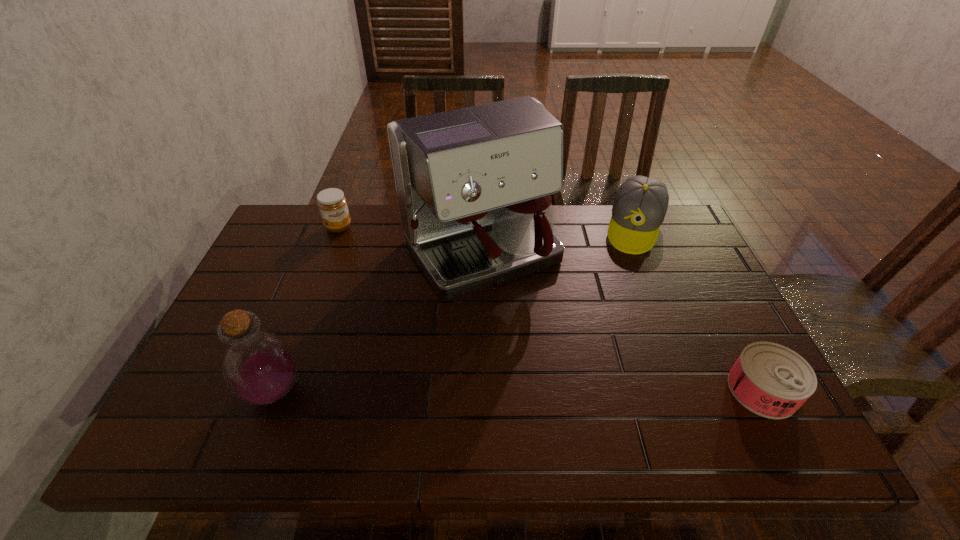
The height and width of the screenshot is (540, 960). In order to click on the fourth shortest object in this screenshot , I will do `click(259, 367)`.

Find the location of a particular element. can is located at coordinates (769, 379).

You are a GUI agent. You are given a task and a screenshot of the screen. Output one action in this format:
    pyautogui.click(x=<x>, y=<y>)
    Task: Click on the coffee maker
    The width and height of the screenshot is (960, 540).
    Given the screenshot: What is the action you would take?
    pyautogui.click(x=474, y=185)

Find the location of a particular element. This screenshot has height=540, width=960. the third object from left to right is located at coordinates (474, 185).

The width and height of the screenshot is (960, 540). In order to click on the fourth tallest object in this screenshot , I will do `click(332, 204)`.

Locate an element on the screen. The width and height of the screenshot is (960, 540). the third shortest object is located at coordinates (640, 205).

At what (x,y) coordinates should I click in order to perform the action: click on free space located 0.190m on the right of the fourth shortest object. Please return your answer as a coordinate pair (x, y). Looking at the image, I should click on coord(391,391).

The height and width of the screenshot is (540, 960). What are the coordinates of `vacant space located 0.130m on the left of the can` in the screenshot? It's located at (672, 389).

The width and height of the screenshot is (960, 540). I want to click on vacant point located on the front of the tallest object near the spout, so click(553, 357).

This screenshot has width=960, height=540. I want to click on free space located 0.130m on the front of the tallest object near the spout, so click(x=542, y=342).